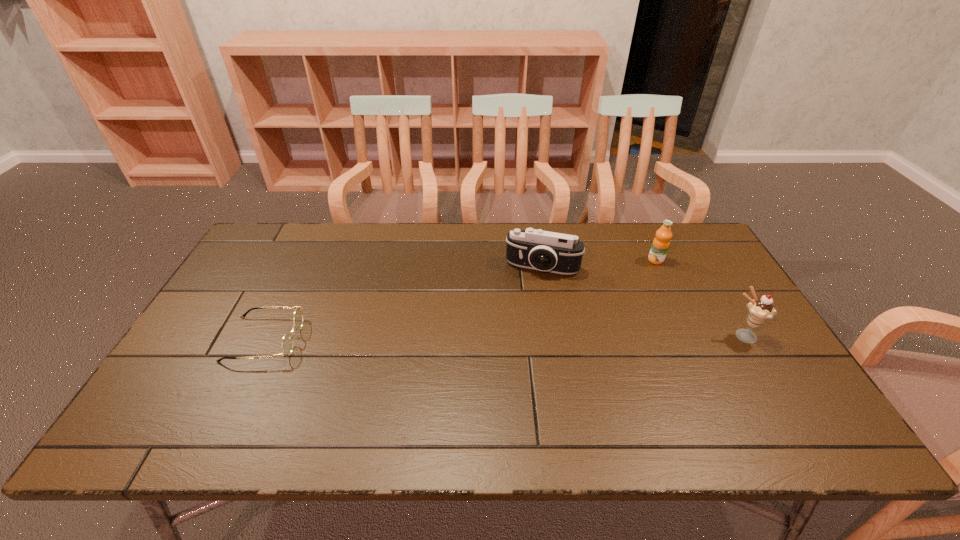
Find the location of a particular element. This screenshot has width=960, height=540. free area in between the camera and the orange juice is located at coordinates (599, 264).

Locate an element on the screen. This screenshot has width=960, height=540. free space between the second object from left to right and the leftmost object is located at coordinates (403, 303).

Image resolution: width=960 pixels, height=540 pixels. Identify the location of free space that is in between the camera and the shortest object. (403, 303).

You are a GUI agent. You are given a task and a screenshot of the screen. Output one action in this format:
    pyautogui.click(x=<x>, y=<y>)
    Task: Click on the vacant area that lies between the icecream and the spectacles
    The width and height of the screenshot is (960, 540).
    Given the screenshot: What is the action you would take?
    pyautogui.click(x=503, y=338)

Locate an element on the screen. This screenshot has height=540, width=960. the closest object to the camera is located at coordinates (660, 245).

Find the location of `object that stands as the third closest to the leftmost object`. object that stands as the third closest to the leftmost object is located at coordinates (760, 310).

Where is `free region that satisfies the following two spatial constraints: 1. on the front side of the icecream; 2. on the right side of the second object from right to left`? This screenshot has height=540, width=960. free region that satisfies the following two spatial constraints: 1. on the front side of the icecream; 2. on the right side of the second object from right to left is located at coordinates (692, 336).